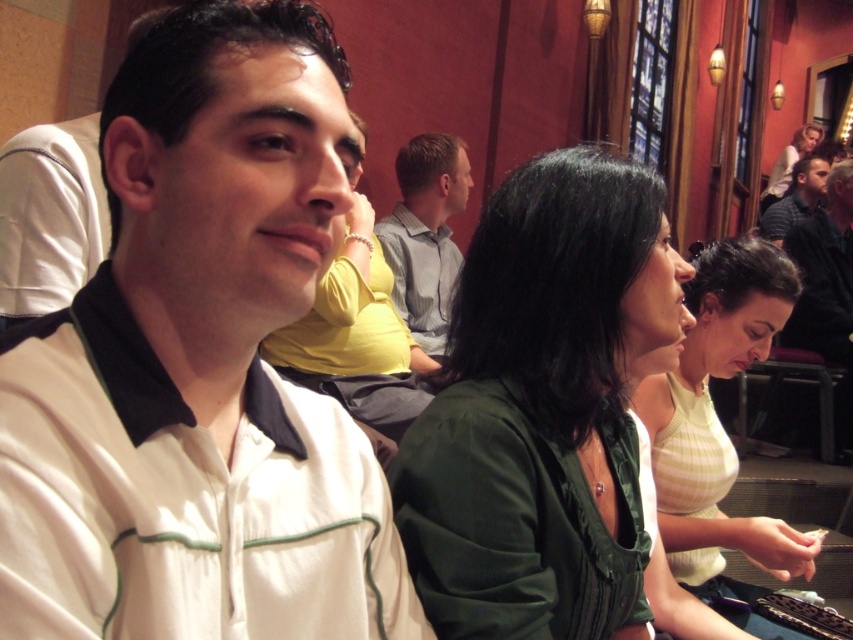
You are a photographer standing at the entrance of the restaurant. You want to take a photo of the matte green blouse at center and ensure that the person wearing it is in focus while blurring the background. Given that your camera has a depth of field setting that can blur objects beyond 2 meters away, will the background be sufficiently blurred?

The matte green blouse at center is 2.09 meters away from the photographer. Since the depth of field setting blurs objects beyond 2 meters, the background will be slightly out of focus but not fully blurred because the distance is just over the threshold. Adjust the settings to a slightly longer blur distance for better background separation.

You are standing in the restaurant scene and want to place a small decoration between the two points labeled point (564, 310) and point (828, 346). Which point should the decoration be closer to in order to appear larger in the image?

The decoration should be placed closer to point (564, 310) because it is closer to the viewer than point (828, 346), making objects near it appear larger.

You are a photographer setting up for a group photo. You notice the green fabric shirt at center and the dark blue shirt at right. Which shirt should you adjust to ensure both are fully visible in the frame?

Answer: The green fabric shirt at center is below the dark blue shirt at right. To ensure both are fully visible, adjust the dark blue shirt at right to move it higher or the green fabric shirt at center to move it lower.